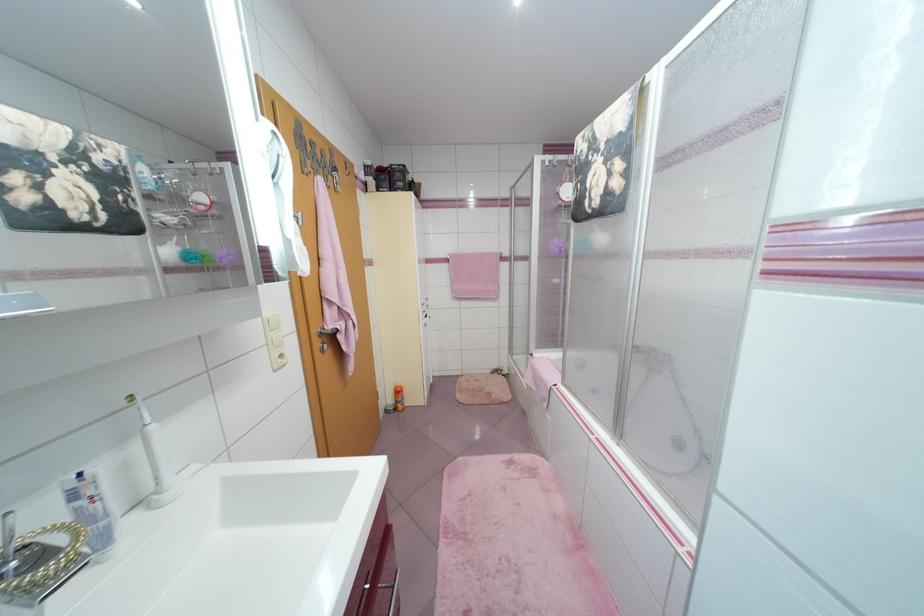
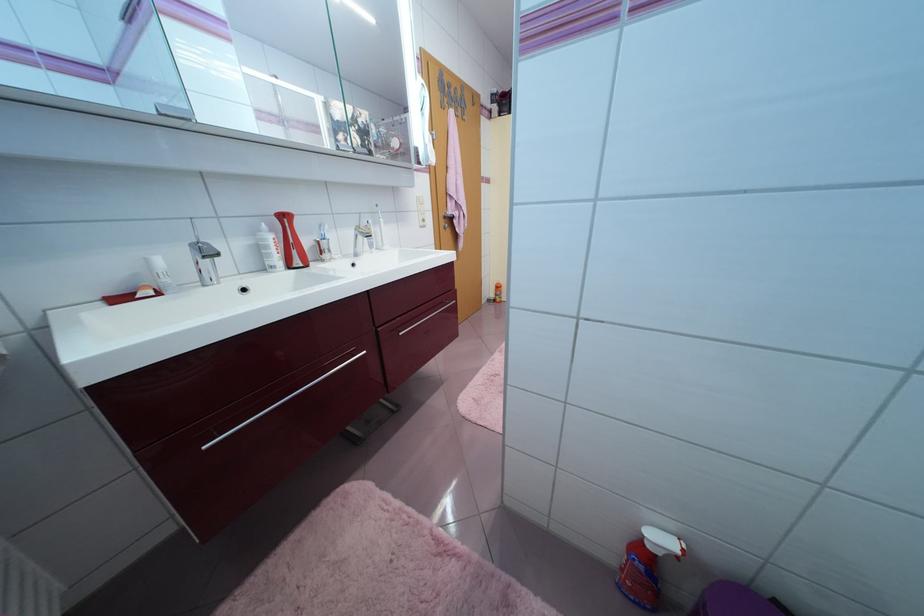
In the second image, find the point that corresponds to the point at 293,243 in the first image.

(431, 147)